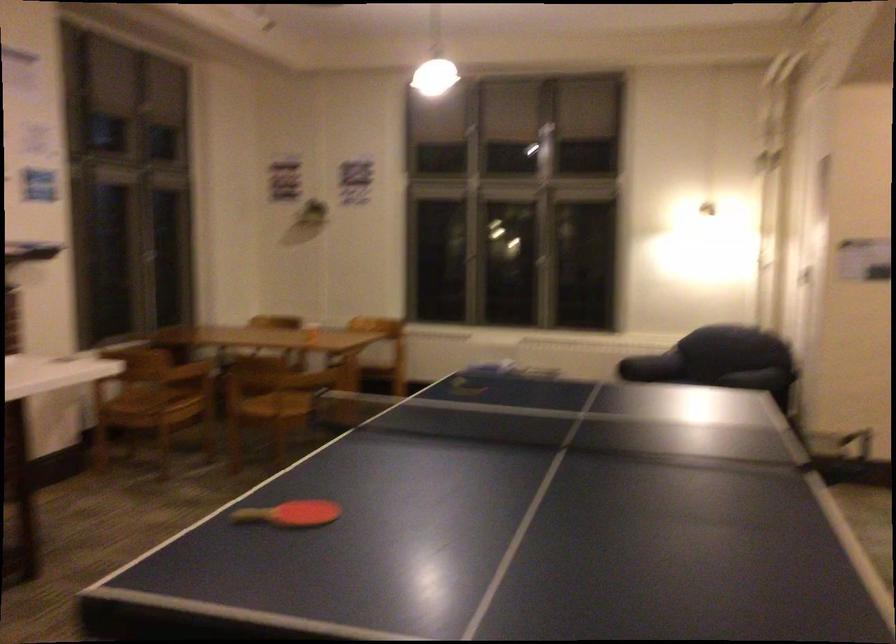
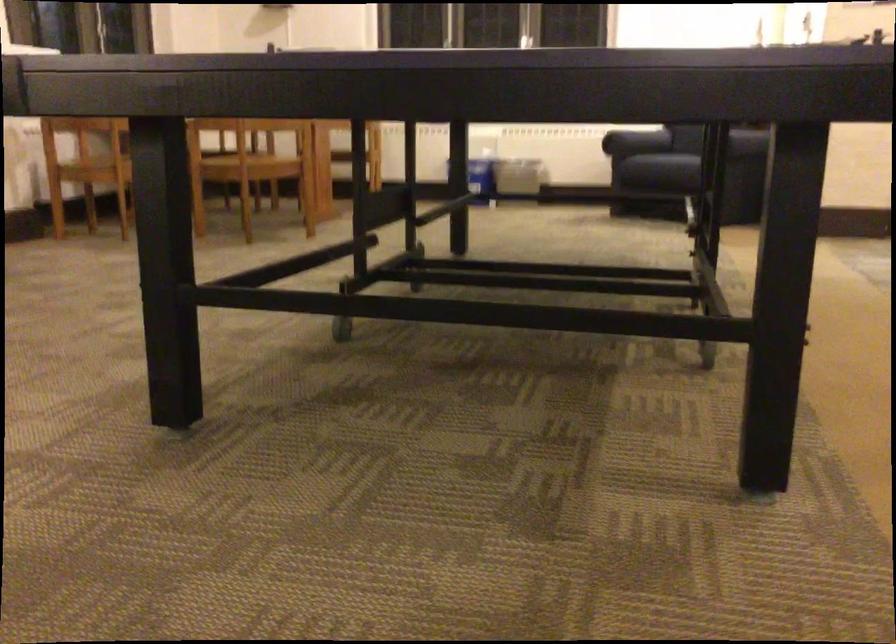
Question: Based on the continuous images, in which direction is the camera rotating? Reply with the corresponding letter.

Choices:
 (A) Left
 (B) Right
 (C) Up
 (D) Down

Answer: (D)